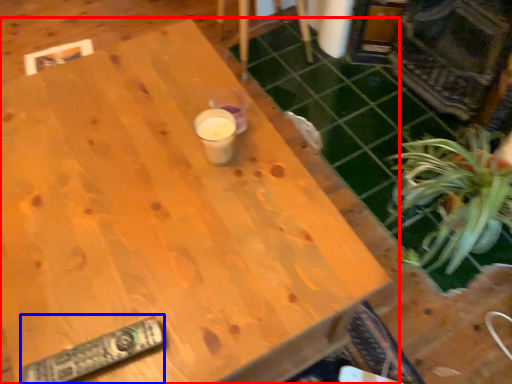
Question: Which of the following is the closest to the observer, table (highlighted by a red box) or remote (highlighted by a blue box)?

Choices:
 (A) table
 (B) remote

Answer: (A)